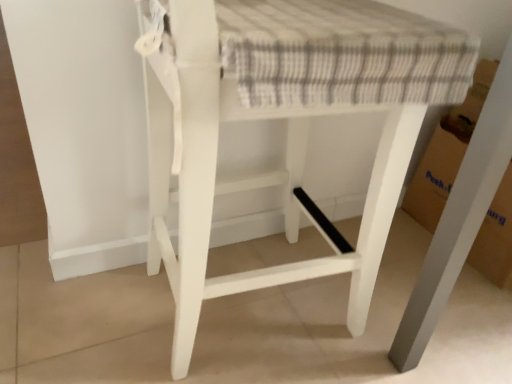
Identify the location of vacant space underneath white painted wood stool at center (from a real-world perspective). The width and height of the screenshot is (512, 384). (248, 316).